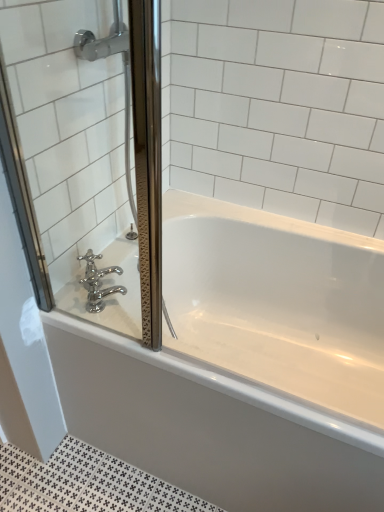
Identify the location of free space that is to the left of polished chrome faucet at lower left. The image size is (384, 512). (69, 304).